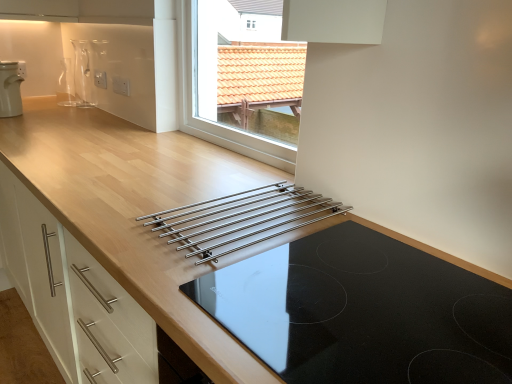
Question: From a real-world perspective, does white plastic kettle at upper left stand above black glass cooktop at center?

Choices:
 (A) yes
 (B) no

Answer: (A)

Question: From the image's perspective, would you say white plastic kettle at upper left is positioned over black glass cooktop at center?

Choices:
 (A) no
 (B) yes

Answer: (B)

Question: Can you confirm if white plastic kettle at upper left is positioned to the left of black glass cooktop at center?

Choices:
 (A) yes
 (B) no

Answer: (A)

Question: Does white plastic kettle at upper left have a larger size compared to black glass cooktop at center?

Choices:
 (A) yes
 (B) no

Answer: (B)

Question: Is white plastic kettle at upper left positioned with its back to black glass cooktop at center?

Choices:
 (A) no
 (B) yes

Answer: (A)

Question: Would you say white plastic kettle at upper left is a long distance from black glass cooktop at center?

Choices:
 (A) yes
 (B) no

Answer: (A)

Question: From the image's perspective, is black glass cooktop at center located above white plastic kettle at upper left?

Choices:
 (A) yes
 (B) no

Answer: (B)

Question: Is black glass cooktop at center oriented away from white plastic kettle at upper left?

Choices:
 (A) yes
 (B) no

Answer: (B)

Question: From the image's perspective, is black glass cooktop at center located beneath white plastic kettle at upper left?

Choices:
 (A) no
 (B) yes

Answer: (B)

Question: Considering the relative sizes of black glass cooktop at center and white plastic kettle at upper left in the image provided, is black glass cooktop at center thinner than white plastic kettle at upper left?

Choices:
 (A) no
 (B) yes

Answer: (A)

Question: Does black glass cooktop at center have a lesser height compared to white plastic kettle at upper left?

Choices:
 (A) yes
 (B) no

Answer: (A)

Question: Considering the relative sizes of black glass cooktop at center and white plastic kettle at upper left in the image provided, is black glass cooktop at center smaller than white plastic kettle at upper left?

Choices:
 (A) no
 (B) yes

Answer: (A)

Question: Does stainless steel rack at center have a lesser height compared to transparent glass vase at upper left?

Choices:
 (A) no
 (B) yes

Answer: (B)